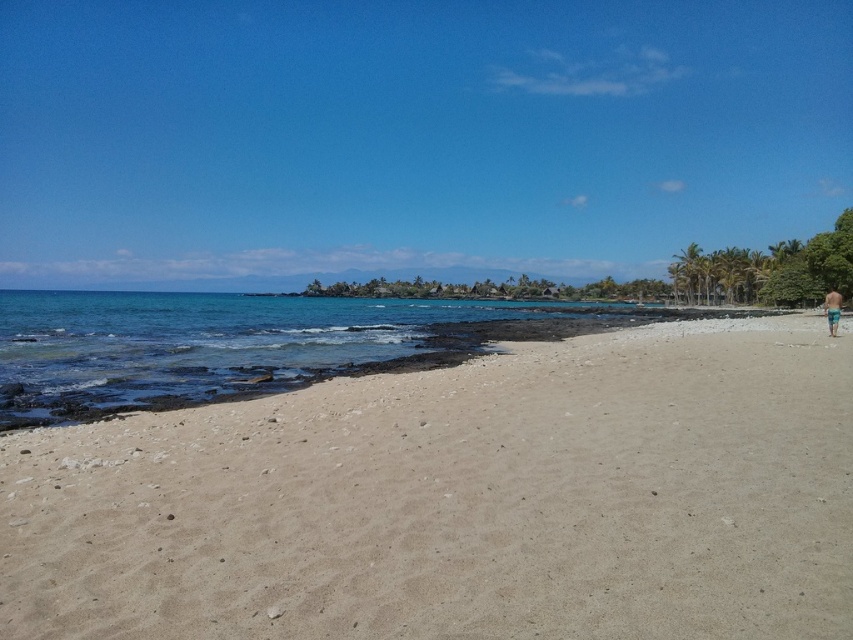
You are standing at the center of the beach and want to place a small flag exactly where the light beige sand at center is located. According to the coordinates provided, where should you place the flag?

The light beige sand at center is located at point coordinates (459, 500). You should place the flag at those coordinates to mark its exact location.

You are standing on the light beige sand at center and want to walk towards the clear blue water at lower left. Which surface will feel coarser under your feet?

The light beige sand at center has a smaller size compared to the clear blue water at lower left, so the sand will feel finer and smoother, while the water might feel less coarse due to its liquid nature. However, since the question refers to surfaces, the sand is the only solid surface here. Therefore, the sand at center feels smoother because it has smaller grains.